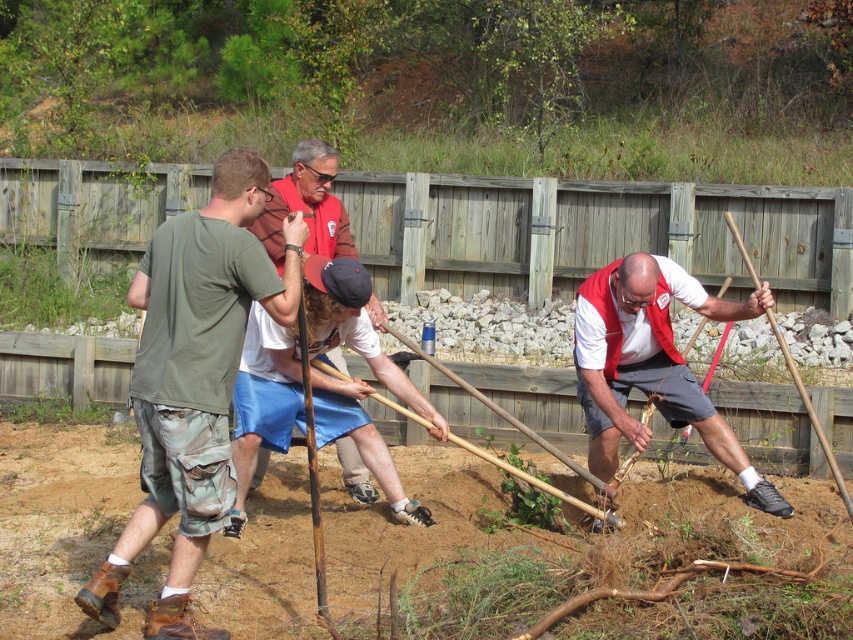
Question: Which point appears closest to the camera in this image?

Choices:
 (A) (198, 346)
 (B) (273, 180)
 (C) (669, 422)

Answer: (A)

Question: Which of the following is the closest to the observer?

Choices:
 (A) white matte vest at center
 (B) green camo shorts at left
 (C) red shirt at center

Answer: (B)

Question: Can you confirm if white matte vest at center is thinner than red shirt at center?

Choices:
 (A) no
 (B) yes

Answer: (A)

Question: Is white matte vest at center smaller than red shirt at center?

Choices:
 (A) yes
 (B) no

Answer: (B)

Question: Which point appears closest to the camera in this image?

Choices:
 (A) (328, 253)
 (B) (751, 465)
 (C) (235, 248)

Answer: (C)

Question: Does white matte vest at center appear over red shirt at center?

Choices:
 (A) no
 (B) yes

Answer: (A)